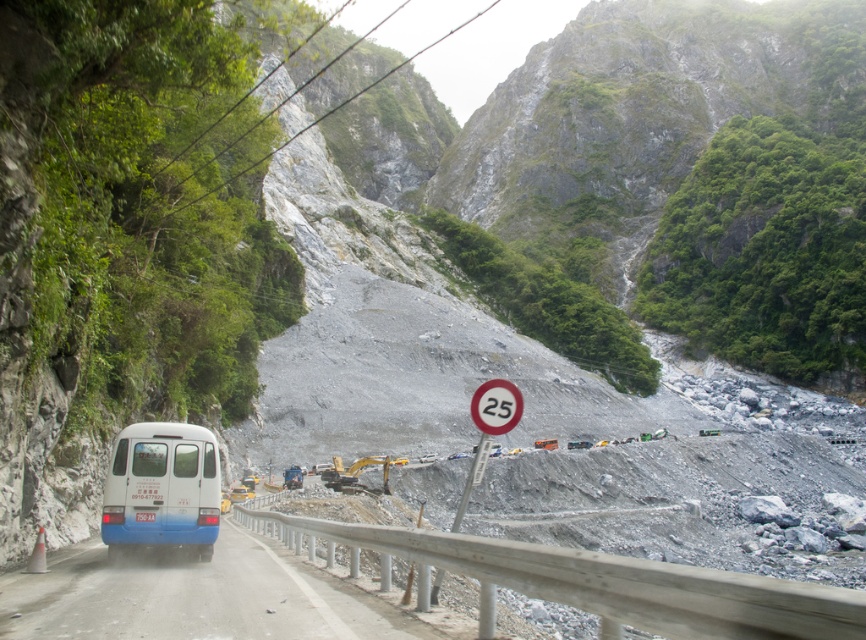
Which is in front, point (160, 515) or point (514, 410)?

Point (514, 410)

Between blue matte bus at left and white plastic speed limit sign at center, which one has less height?

blue matte bus at left is shorter.

Does point (144, 541) come in front of point (501, 387)?

No, it is behind (501, 387).

Locate an element on the screen. blue matte bus at left is located at coordinates [x=162, y=486].